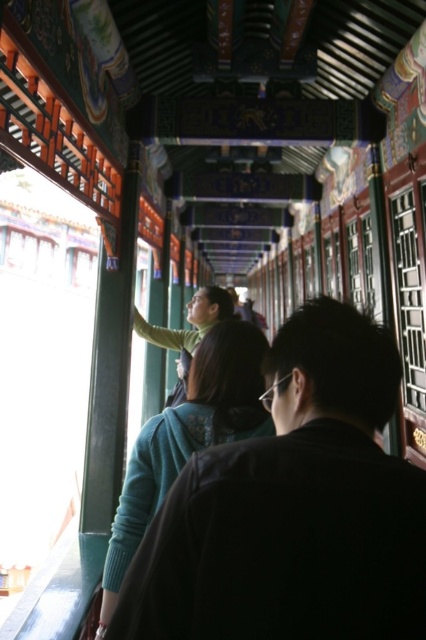
From the picture: You are standing in the corridor and see both the black matte jacket at center and the matte green sweater at center. Which one is located to the right side?

The black matte jacket at center is positioned on the right side of the matte green sweater at center.

You are standing at the entrance of the corridor and see the black matte jacket at center. If you walk straight ahead, will the jacket remain in your line of sight as you move forward?

The black matte jacket at center is located at point (293,508), which suggests it is positioned along the central axis of the corridor. Since the corridor has multiple windows and an ornate ceiling, walking straight ahead would keep the jacket in your line of sight unless there are obstructions like pillars or turns. However, based on the provided scene description, there are no mentions of such obstructions. Therefore, the jacket should remain visible as you move forward.